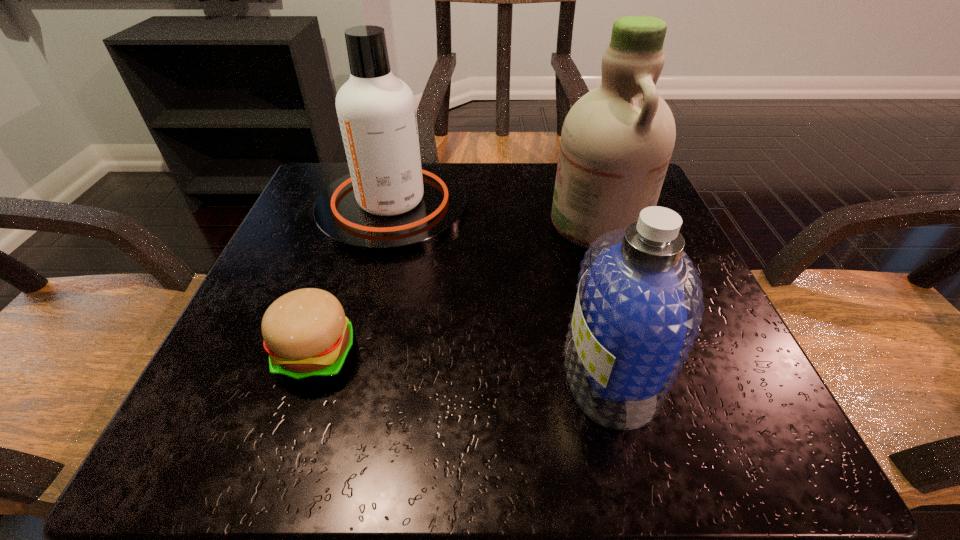
Where is `object at the far left corner`? The height and width of the screenshot is (540, 960). object at the far left corner is located at coordinates (389, 204).

I want to click on object that is at the far right corner, so click(616, 142).

What are the coordinates of `object at the near right corner` in the screenshot? It's located at (638, 308).

At what (x,y) coordinates should I click in order to perform the action: click on vacant region at the far edge of the desktop. Please return your answer as a coordinate pair (x, y). This screenshot has height=540, width=960. Looking at the image, I should click on (536, 224).

Find the location of a particular element. The width and height of the screenshot is (960, 540). free space at the near edge of the desktop is located at coordinates (605, 451).

Find the location of a particular element. This screenshot has width=960, height=540. free space at the right edge is located at coordinates (749, 384).

This screenshot has height=540, width=960. What are the coordinates of `empty space that is in between the shortest cleansing agent and the shortest object` in the screenshot? It's located at (464, 364).

Where is `free space between the shortest object and the third tallest object`? free space between the shortest object and the third tallest object is located at coordinates (464, 364).

I want to click on unoccupied position between the hamburger and the leftmost cleansing agent, so click(354, 281).

Locate an element on the screen. The height and width of the screenshot is (540, 960). vacant space that's between the shortest object and the second shortest object is located at coordinates (464, 364).